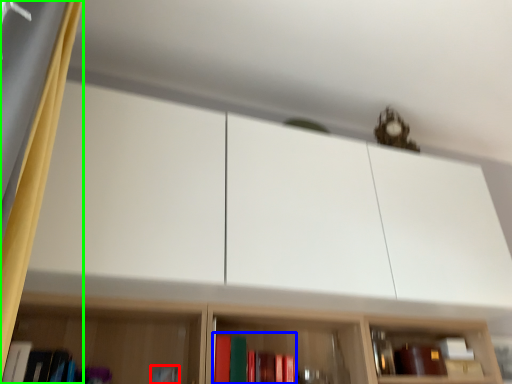
Question: Estimate the real-world distances between objects in this image. Which object is farther from book (highlighted by a red box), book (highlighted by a blue box) or curtain (highlighted by a green box)?

Choices:
 (A) book
 (B) curtain

Answer: (B)